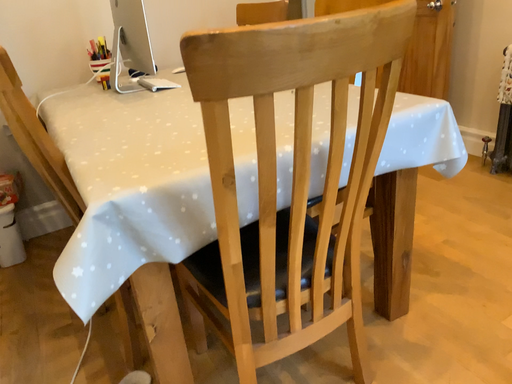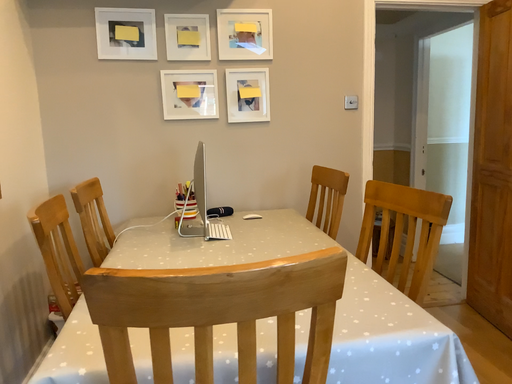
Question: How did the camera likely rotate when shooting the video?

Choices:
 (A) rotated downward
 (B) rotated upward

Answer: (B)